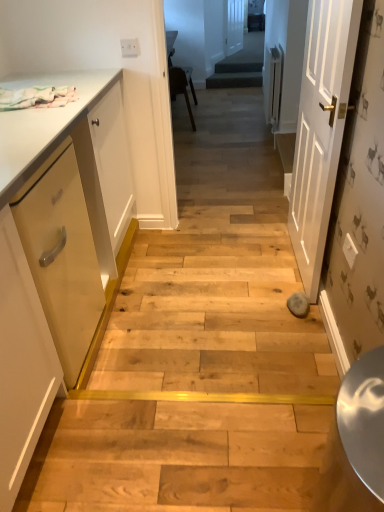
Question: From the image's perspective, is dark green carpeted stairs at center located above white painted wood door at center right, which is counted as the 1th door, starting from the bottom?

Choices:
 (A) yes
 (B) no

Answer: (A)

Question: From a real-world perspective, is dark green carpeted stairs at center physically below white painted wood door at center right, which is counted as the 1th door, starting from the bottom?

Choices:
 (A) yes
 (B) no

Answer: (A)

Question: Considering the relative sizes of dark green carpeted stairs at center and white painted wood door at center right, which is counted as the 1th door, starting from the bottom, in the image provided, is dark green carpeted stairs at center thinner than white painted wood door at center right, which is counted as the 1th door, starting from the bottom,?

Choices:
 (A) yes
 (B) no

Answer: (A)

Question: Does dark green carpeted stairs at center have a larger size compared to white painted wood door at center right, acting as the second door starting from the top?

Choices:
 (A) yes
 (B) no

Answer: (B)

Question: Are dark green carpeted stairs at center and white painted wood door at center right, placed as the second door when sorted from back to front, beside each other?

Choices:
 (A) yes
 (B) no

Answer: (B)

Question: From the image's perspective, is matte yellow drawer at left above or below white painted wood door at center right, placed as the second door when sorted from back to front?

Choices:
 (A) below
 (B) above

Answer: (A)

Question: Visually, is matte yellow drawer at left positioned to the left or to the right of white painted wood door at center right, the 1th door viewed from the front?

Choices:
 (A) right
 (B) left

Answer: (B)

Question: Considering the positions of point (79, 199) and point (306, 243), is point (79, 199) closer or farther from the camera than point (306, 243)?

Choices:
 (A) farther
 (B) closer

Answer: (B)

Question: Relative to white painted wood door at center right, the 1th door viewed from the front, is matte yellow drawer at left in front or behind?

Choices:
 (A) front
 (B) behind

Answer: (A)

Question: In the image, is matte yellow drawer at left positioned in front of or behind matte white cabinet at left?

Choices:
 (A) front
 (B) behind

Answer: (B)

Question: Is matte yellow drawer at left taller or shorter than matte white cabinet at left?

Choices:
 (A) short
 (B) tall

Answer: (A)

Question: Is point (87, 350) positioned closer to the camera than point (54, 265)?

Choices:
 (A) closer
 (B) farther

Answer: (B)

Question: From a real-world perspective, is matte yellow drawer at left positioned above or below matte white cabinet at left?

Choices:
 (A) above
 (B) below

Answer: (A)

Question: From the image's perspective, is white painted wood door at center right, which is counted as the 1th door, starting from the bottom, located above or below matte white cabinet at left?

Choices:
 (A) above
 (B) below

Answer: (A)

Question: Choose the correct answer: Is white painted wood door at center right, the 1th door viewed from the front, inside matte white cabinet at left or outside it?

Choices:
 (A) outside
 (B) inside

Answer: (A)